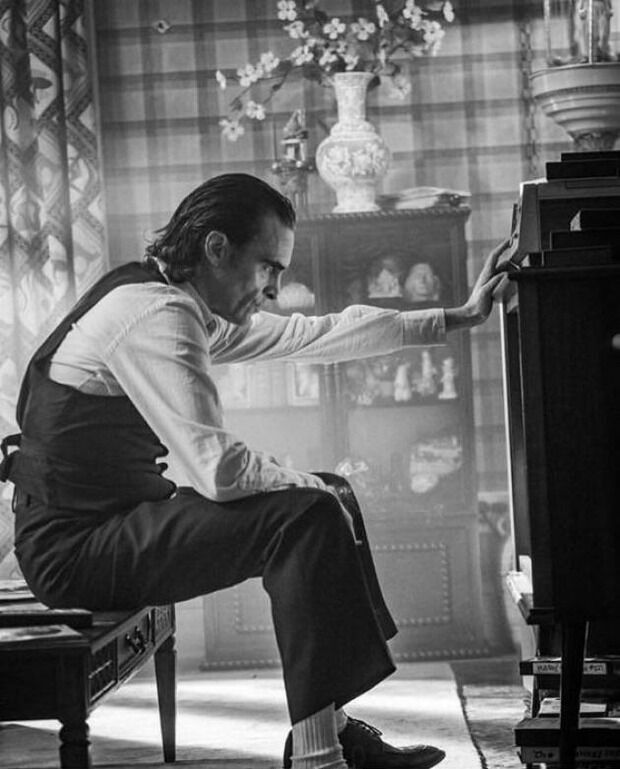
Locate an element on the screen. plant is located at coordinates (348, 65).